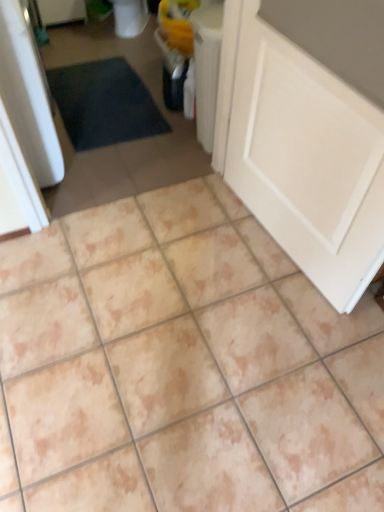
In order to click on vacant area that is in front of white matte door at lower right in this screenshot , I will do `click(270, 343)`.